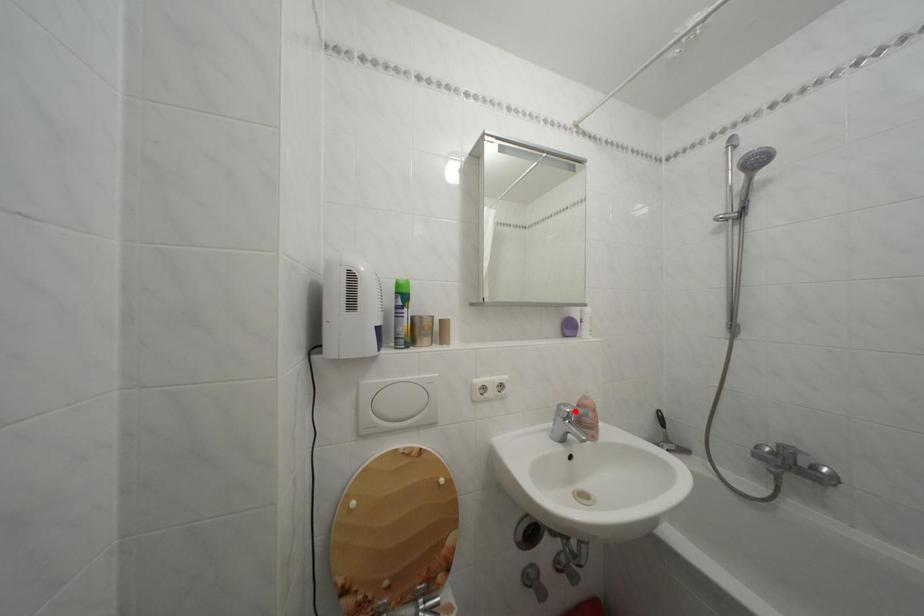
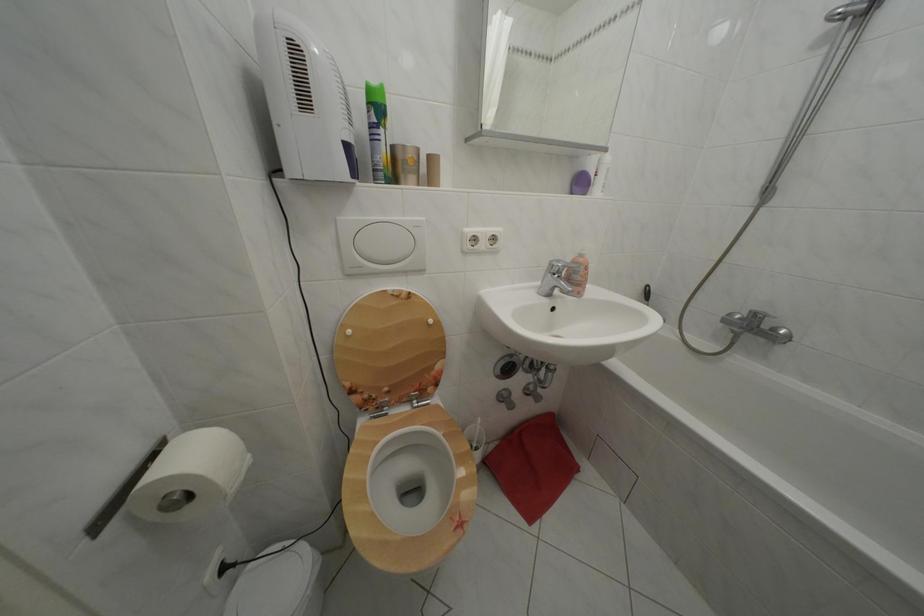
Find the pixel in the second image that matches the highlighted location in the first image.

(567, 268)